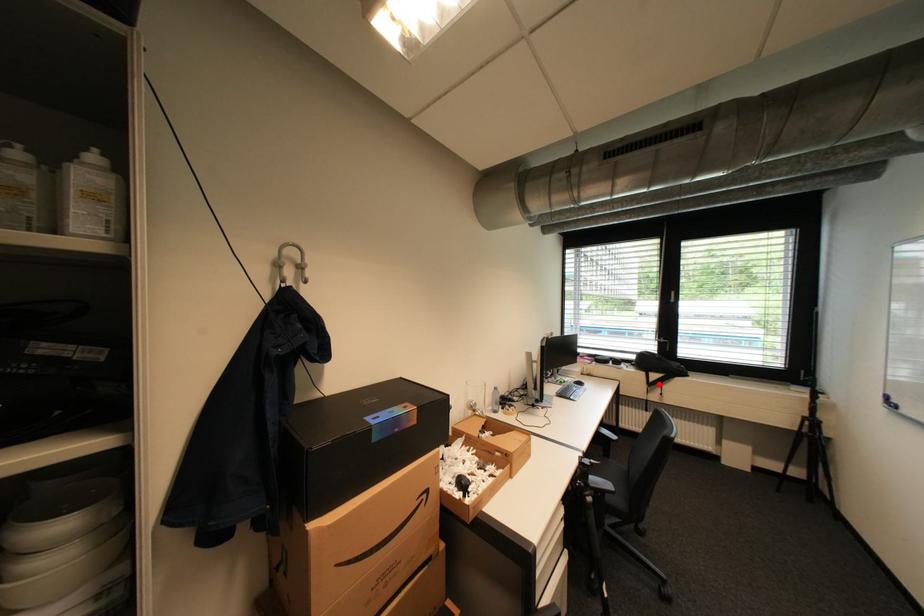
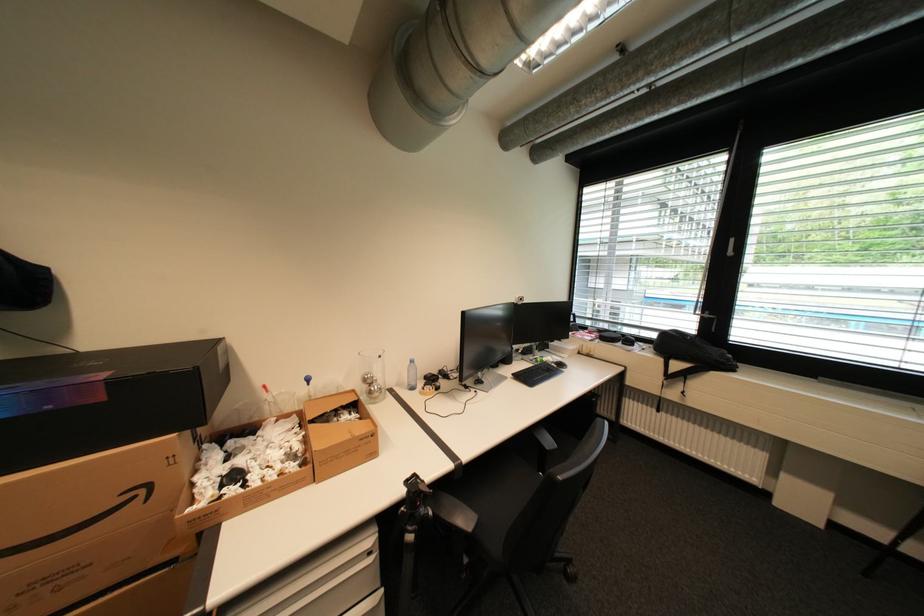
In the second image, find the point that corresponds to the highlighted location in the first image.

(678, 377)